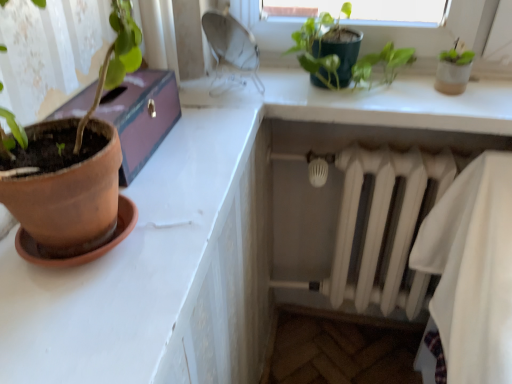
Question: From the image's perspective, is white matte radiator at lower right on top of terracotta clay pot at left?

Choices:
 (A) yes
 (B) no

Answer: (B)

Question: Can you confirm if white matte radiator at lower right is taller than terracotta clay pot at left?

Choices:
 (A) yes
 (B) no

Answer: (A)

Question: Is terracotta clay pot at left a part of white matte radiator at lower right?

Choices:
 (A) no
 (B) yes

Answer: (A)

Question: Considering the relative sizes of white matte radiator at lower right and terracotta clay pot at left in the image provided, is white matte radiator at lower right bigger than terracotta clay pot at left?

Choices:
 (A) yes
 (B) no

Answer: (A)

Question: Is white matte radiator at lower right placed right next to terracotta clay pot at left?

Choices:
 (A) no
 (B) yes

Answer: (A)

Question: Considering their positions, is terracotta clay pot at left located in front of or behind green matte plant at upper center?

Choices:
 (A) behind
 (B) front

Answer: (B)

Question: Is terracotta clay pot at left inside or outside of green matte plant at upper center?

Choices:
 (A) inside
 (B) outside

Answer: (B)

Question: In the image, is terracotta clay pot at left on the left side or the right side of green matte plant at upper center?

Choices:
 (A) right
 (B) left

Answer: (B)

Question: Looking at the image, does terracotta clay pot at left seem bigger or smaller compared to green matte plant at upper center?

Choices:
 (A) small
 (B) big

Answer: (B)

Question: Would you say white matte radiator at lower right is to the left or to the right of terracotta clay pot at left in the picture?

Choices:
 (A) left
 (B) right

Answer: (B)

Question: From a real-world perspective, is white matte radiator at lower right positioned above or below terracotta clay pot at left?

Choices:
 (A) below
 (B) above

Answer: (A)

Question: Is white matte radiator at lower right bigger or smaller than terracotta clay pot at left?

Choices:
 (A) big
 (B) small

Answer: (A)

Question: Is white matte radiator at lower right taller or shorter than terracotta clay pot at left?

Choices:
 (A) tall
 (B) short

Answer: (A)

Question: From the image's perspective, relative to terracotta clay pot at left, is green matte plant at upper center above or below?

Choices:
 (A) below
 (B) above

Answer: (B)

Question: Would you say green matte plant at upper center is to the left or to the right of terracotta clay pot at left in the picture?

Choices:
 (A) left
 (B) right

Answer: (B)